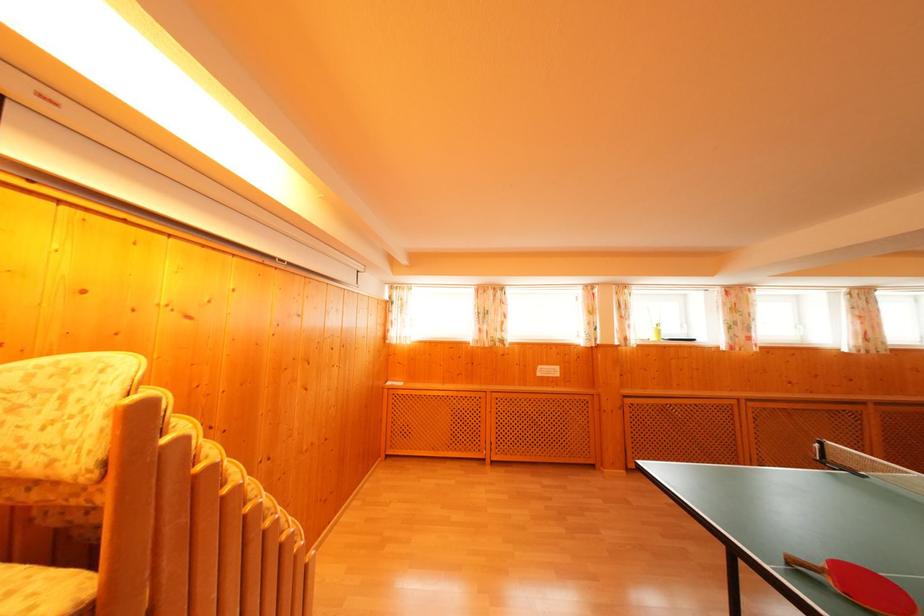
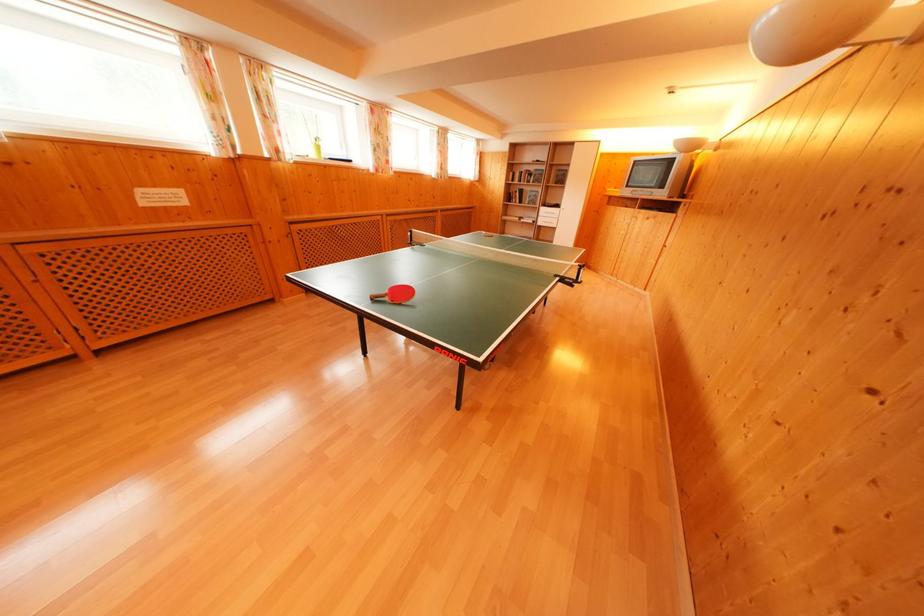
The images are taken continuously from a first-person perspective. In which direction is your viewpoint rotating?

The camera rotated toward right-down.